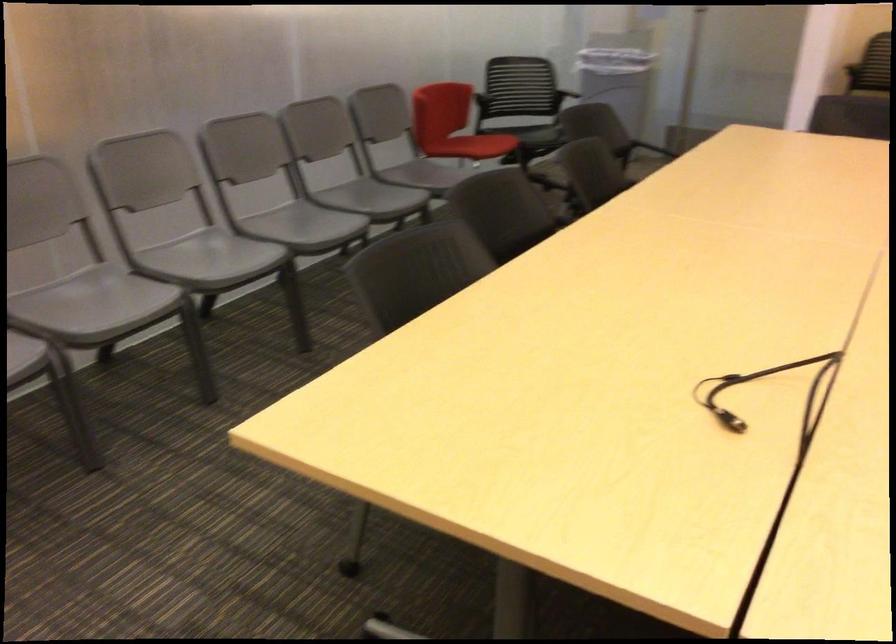
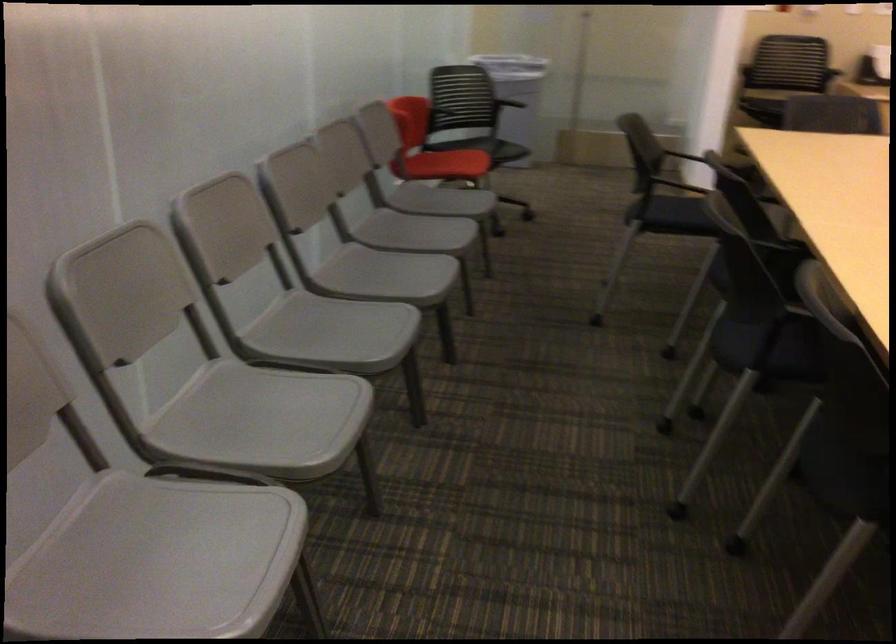
Where in the second image is the point corresponding to (x=316, y=225) from the first image?

(385, 275)